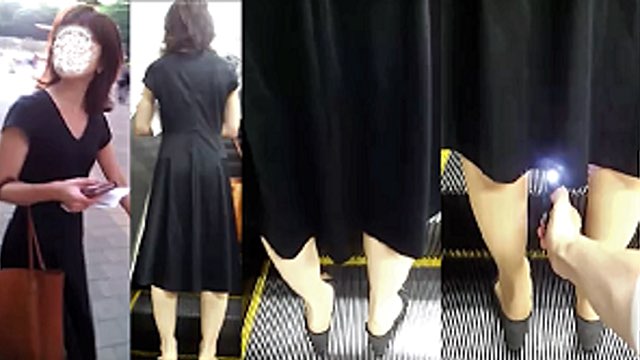
This screenshot has width=640, height=360. I want to click on light, so click(552, 175).